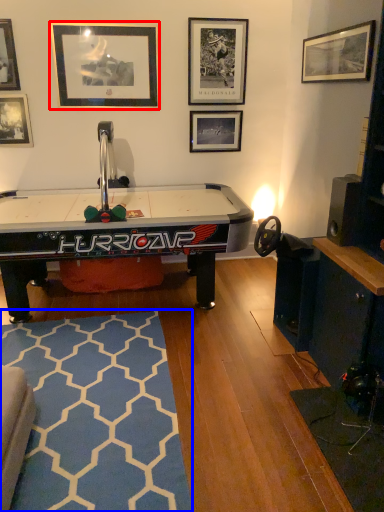
Question: Among these objects, which one is farthest to the camera, picture frame (highlighted by a red box) or mat (highlighted by a blue box)?

Choices:
 (A) picture frame
 (B) mat

Answer: (A)